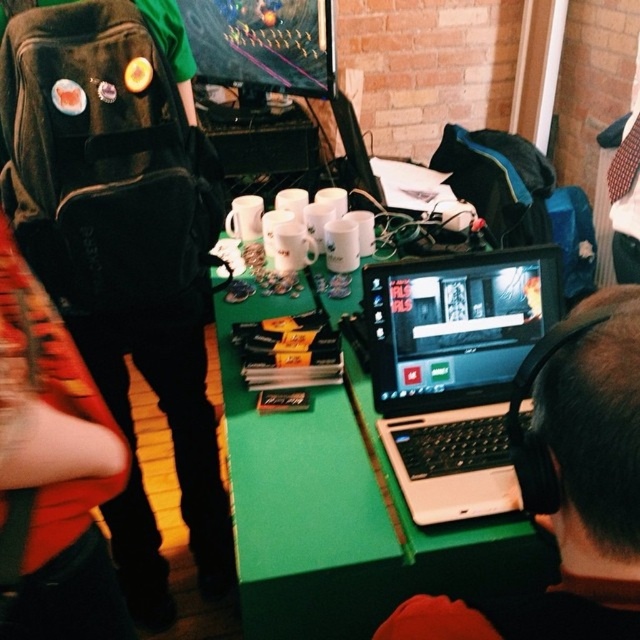
You are sitting at the green matte table at center and want to place your white plastic laptop at center on the table. Is the laptop currently positioned under or above the table surface?

The green matte table at center is above the white plastic laptop at center, meaning the laptop is positioned under the table surface.

You are setting up a desk for a presentation and need to place both the black matte laptop at lower right and the white plastic laptop at center. Which laptop should you choose if you want the one that takes up less space vertically?

The black matte laptop at lower right is thinner than the white plastic laptop at center, so it takes up less vertical space and should be chosen for the presentation setup.

You are sitting at the green matte table at center and want to reach the white plastic laptop at center. Based on the spatial relationship between them, can you directly access the laptop without moving the table?

The green matte table at center is in front of the white plastic laptop at center, so you can directly access the laptop without needing to move the table since it is positioned in front of it.